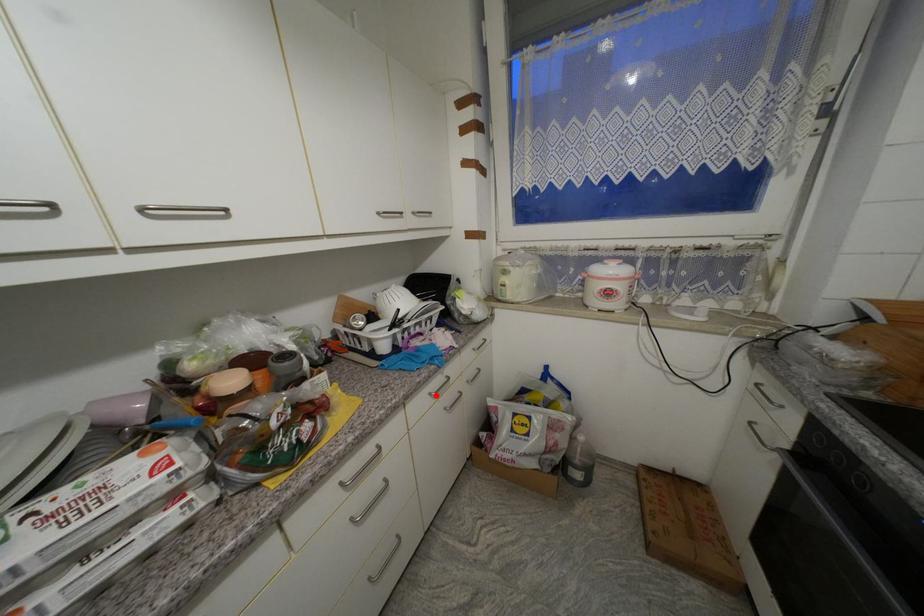
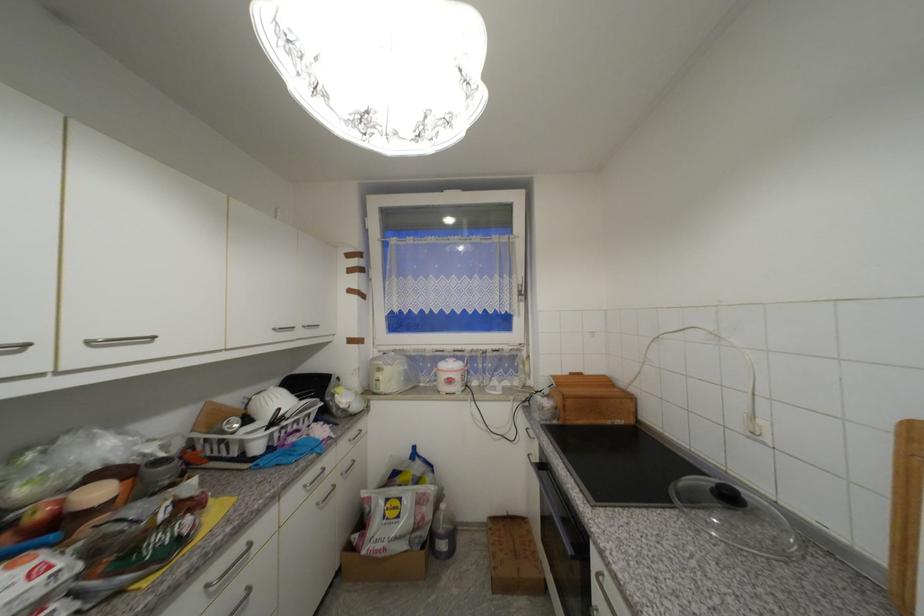
Locate, in the second image, the point that corresponds to the highlighted location in the first image.

(310, 488)